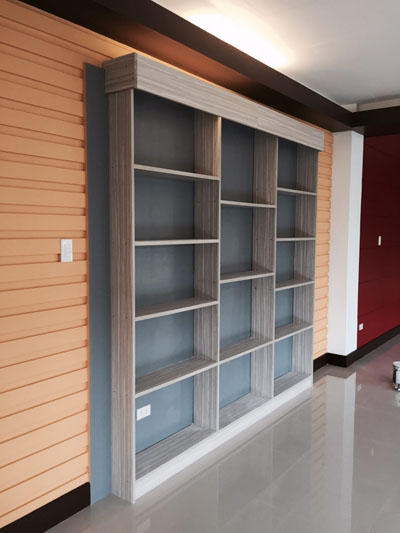
Where is `peach colored wall`? Image resolution: width=400 pixels, height=533 pixels. peach colored wall is located at coordinates (25, 243).